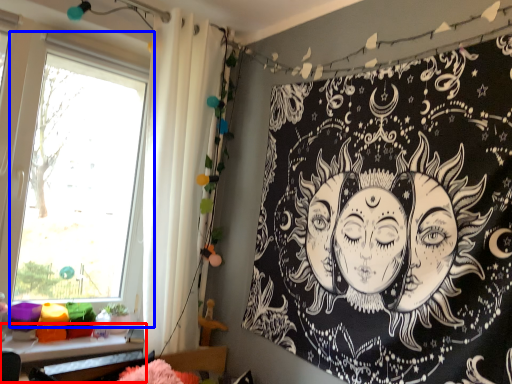
Question: Which point is further to the camera, table (highlighted by a red box) or window (highlighted by a blue box)?

Choices:
 (A) table
 (B) window

Answer: (A)